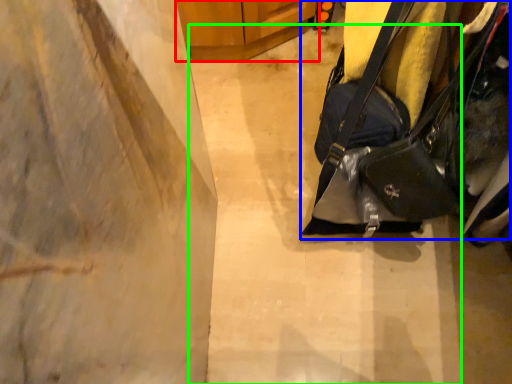
Question: Which object is positioned closest to furniture (highlighted by a red box)? Select from handbag (highlighted by a blue box) and concrete (highlighted by a green box).

Choices:
 (A) handbag
 (B) concrete

Answer: (B)